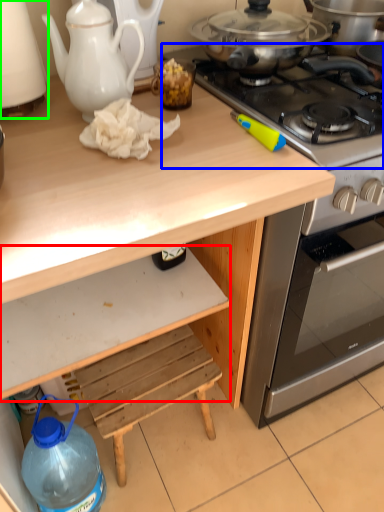
Question: Estimate the real-world distances between objects in this image. Which object is farther from drawer (highlighted by a red box), gas stove (highlighted by a blue box) or kitchen appliance (highlighted by a green box)?

Choices:
 (A) gas stove
 (B) kitchen appliance

Answer: (A)